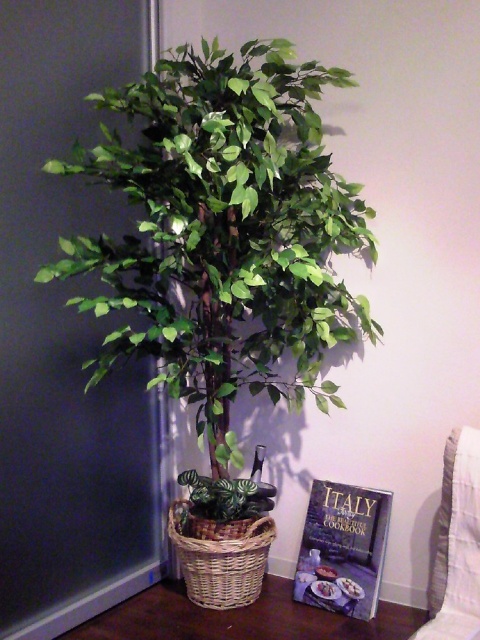
You are standing in a room with a tall artificial tree and a hardcover cookbook at lower right. You want to pick up the cookbook without moving closer than 2 meters from where you are. Can you reach it?

The hardcover cookbook at lower right is 2.06 meters away from the viewer, so you cannot reach it without moving closer than 2 meters because it is slightly farther away.

You are standing in front of the artificial tree and want to place a small decoration between the two points marked as point (x=145, y=614) and point (x=310, y=531). Which point is closer to you where you should start placing the decoration?

Point (x=145, y=614) is closer to the viewer than point (x=310, y=531), so you should start placing the decoration near point (x=145, y=614).